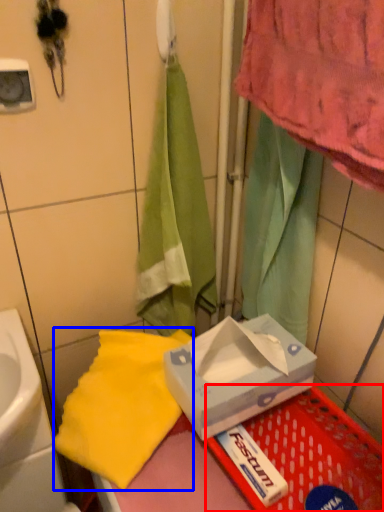
Question: Which object appears closest to the camera in this image, basket (highlighted by a red box) or beach towel (highlighted by a blue box)?

Choices:
 (A) basket
 (B) beach towel

Answer: (A)